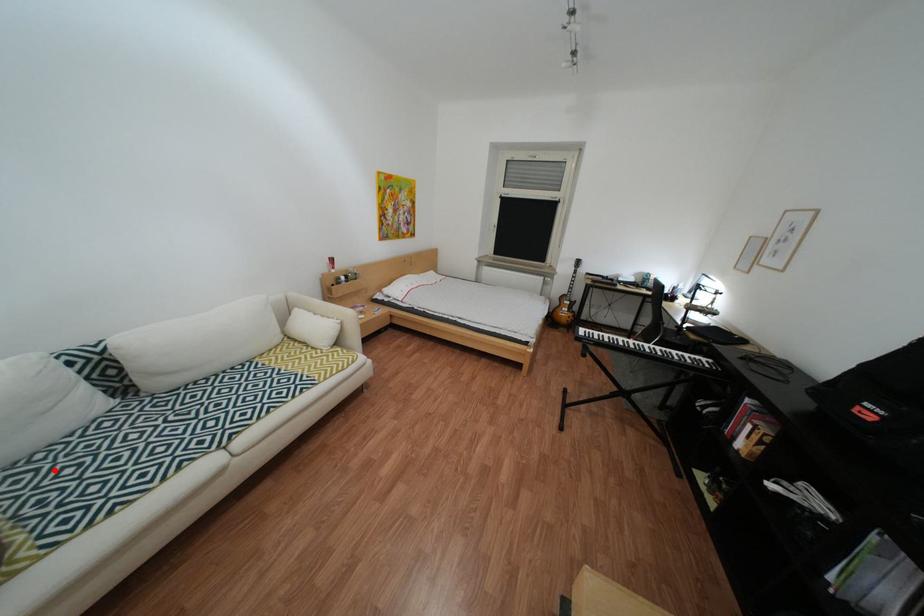
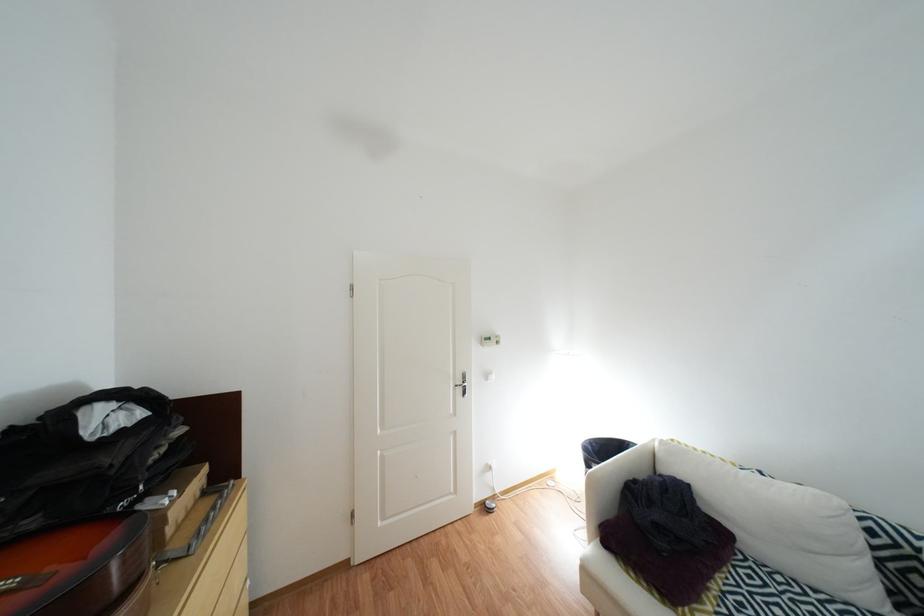
The point at the highlighted location is marked in the first image. Where is the corresponding point in the second image?

(782, 586)